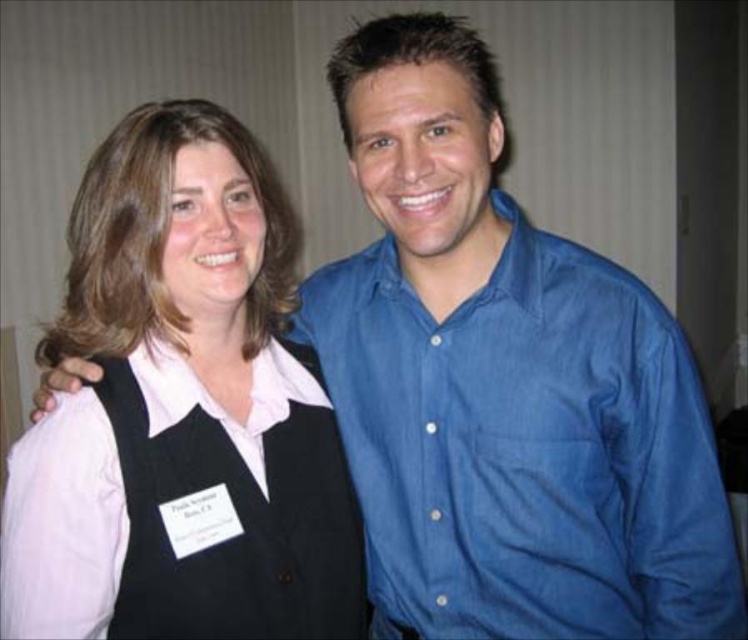
You are a tailor trying to fit a customer for a vest. The customer has two options in front of them, the black matte vest at center and the black fabric vest at center. Which vest should you recommend if the customer prefers a larger size?

The black matte vest at center is bigger than the black fabric vest at center, so you should recommend the black matte vest at center for a larger size.

You are a photographer adjusting the lighting for a group photo. You notice the blue denim shirt at right and the black fabric vest at center. Which one is positioned higher in the frame?

The blue denim shirt at right is located above the black fabric vest at center, so it is positioned higher in the frame.